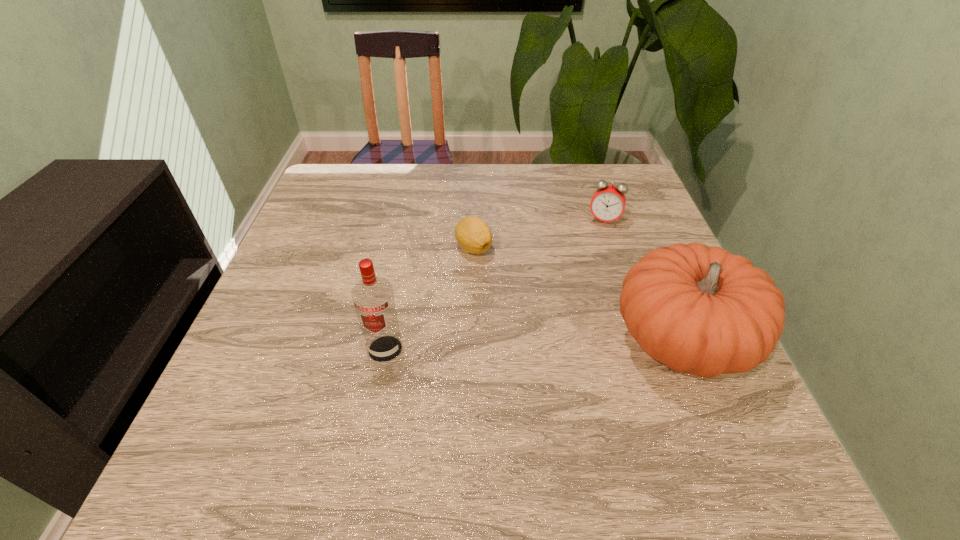
Where is `free region at the left edge of the desktop`? The width and height of the screenshot is (960, 540). free region at the left edge of the desktop is located at coordinates (318, 306).

This screenshot has height=540, width=960. In the image, there is a desktop. Identify the location of vacant region at the right edge. (602, 232).

The image size is (960, 540). In the image, there is a desktop. Find the location of `vacant space at the far right corner`. vacant space at the far right corner is located at coordinates (585, 166).

At what (x,y) coordinates should I click in order to perform the action: click on free space at the near right corner of the desktop. Please return your answer as a coordinate pair (x, y). Looking at the image, I should click on (661, 382).

Find the location of a particular element. unoccupied area between the alarm clock and the shortest object is located at coordinates (539, 234).

I want to click on vacant space that's between the alarm clock and the vodka, so click(494, 285).

Where is `empty location between the farthest object and the leftmost object`? empty location between the farthest object and the leftmost object is located at coordinates (494, 285).

At what (x,y) coordinates should I click in order to perform the action: click on vacant space that is in between the third shortest object and the second farthest object. Please return your answer as a coordinate pair (x, y). This screenshot has height=540, width=960. Looking at the image, I should click on [578, 294].

Identify the location of vacant point located between the shortest object and the leftmost object. (429, 299).

Image resolution: width=960 pixels, height=540 pixels. I want to click on unoccupied area between the second object from left to right and the pumpkin, so point(578,294).